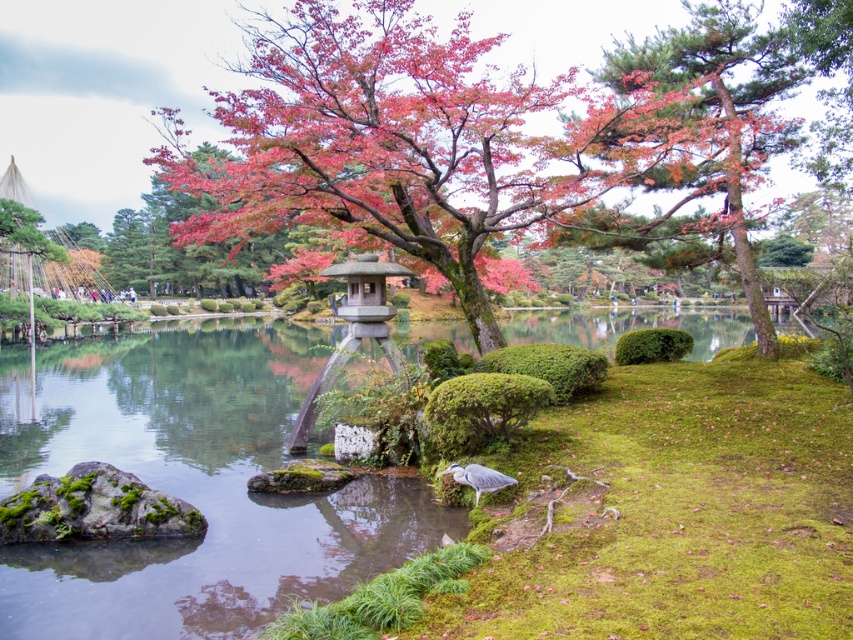
You are standing in the Japanese garden and want to take a photo of the shiny pink leaves at center and the pine tree at upper right. Which object should you focus on first if you want both to be in clear focus?

You should focus on the pine tree at upper right first because it is further away from you than the shiny pink leaves at center, so adjusting focus from far to near can help ensure both are in clear focus.

You are a gardener planning to prune the shiny pink leaves at center and the pine tree at upper right. Which one will require a ladder to reach the top?

The shiny pink leaves at center is much taller than the pine tree at upper right, so you will need a ladder to prune the shiny pink leaves at center.

You are a visitor in the garden and want to take a photo of both the pine tree at upper right and the stone lantern at center. Which object will appear larger in the photo?

The pine tree at upper right will appear larger in the photo because it is much taller than the stone lantern at center.